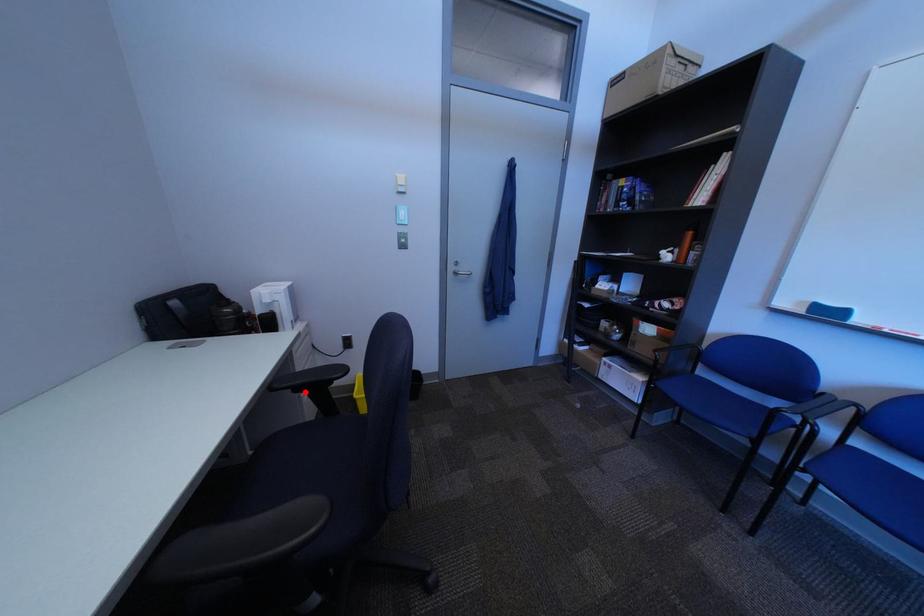
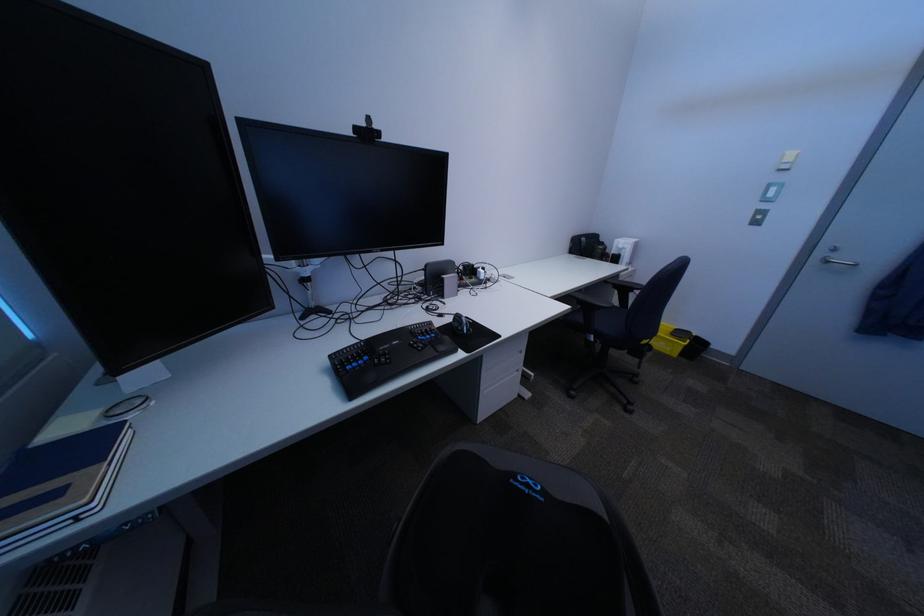
Where in the second image is the point corresponding to the highlighted location from the first image?

(627, 286)